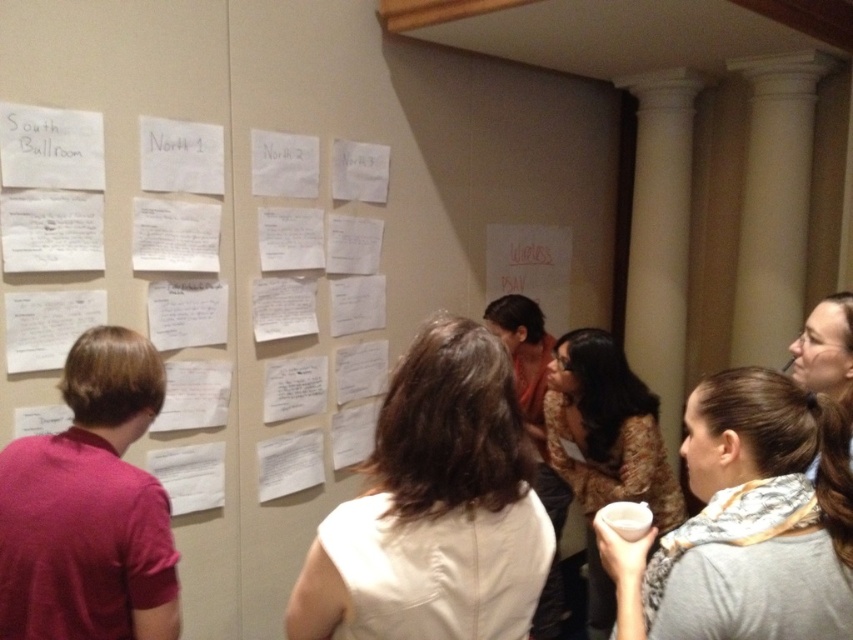
Is white fabric shirt at center thinner than matte red shirt at left?

No.

Does point (474, 515) lie in front of point (77, 576)?

Yes, point (474, 515) is closer to viewer.

Where is `white fabric shirt at center`? white fabric shirt at center is located at coordinates (434, 508).

You are a GUI agent. You are given a task and a screenshot of the screen. Output one action in this format:
    pyautogui.click(x=<x>, y=<y>)
    Task: Click on the gray fabric scarf at lower right
    This screenshot has height=640, width=853.
    Given the screenshot: What is the action you would take?
    pyautogui.click(x=744, y=508)

At what (x,y) coordinates should I click in order to perform the action: click on gray fabric scarf at lower right. Please return your answer as a coordinate pair (x, y). Image resolution: width=853 pixels, height=640 pixels. Looking at the image, I should click on (744, 508).

You are a GUI agent. You are given a task and a screenshot of the screen. Output one action in this format:
    pyautogui.click(x=<x>, y=<y>)
    Task: Click on the gray fabric scarf at lower right
    This screenshot has height=640, width=853.
    Given the screenshot: What is the action you would take?
    pyautogui.click(x=744, y=508)

Does gray fabric scarf at lower right appear under smooth brown hair at upper right?

Indeed, gray fabric scarf at lower right is positioned under smooth brown hair at upper right.

The height and width of the screenshot is (640, 853). What do you see at coordinates (744, 508) in the screenshot?
I see `gray fabric scarf at lower right` at bounding box center [744, 508].

Find the location of a particular element. This screenshot has width=853, height=640. gray fabric scarf at lower right is located at coordinates (744, 508).

Locate an element on the screen. This screenshot has width=853, height=640. gray fabric scarf at lower right is located at coordinates (744, 508).